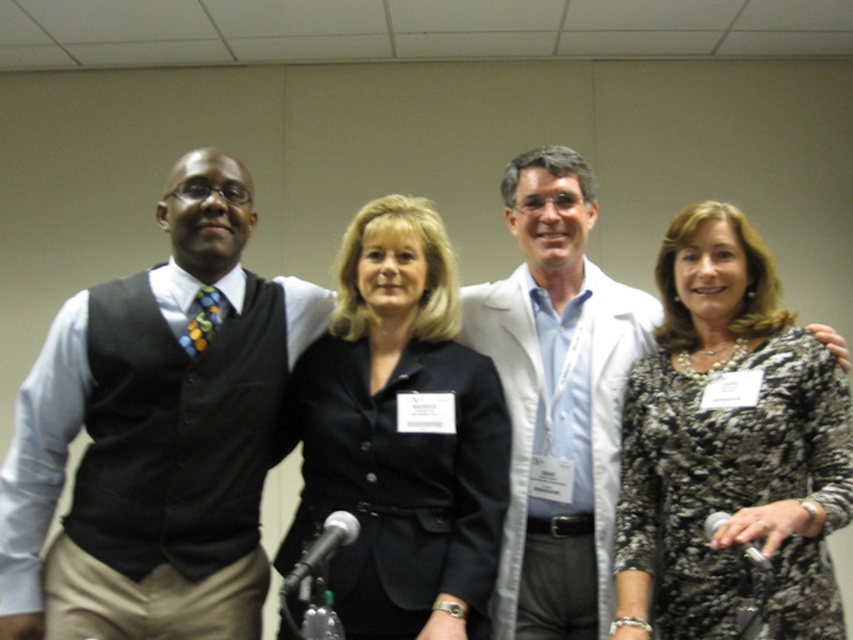
You are standing in the room where the four people are. You want to find the black textured dress at center. Which direction should you look to find it?

The black textured dress at center is located at point 0.700 on the x axis and 0.856 on the y axis. Since the coordinate system is not specified, but assuming standard computer vision coordinates where the origin is at the top left corner, the x increases to the right and y increases downward. Therefore, to find the black textured dress at center, you should look towards the lower right direction from your current position.

From the picture: You are organizing a photo shoot and need to arrange the matte black vest at left and the white lab coat at center so that both are visible in the frame. Given their sizes, which one should you position closer to the camera to ensure both are fully visible?

The matte black vest at left is not as tall as the white lab coat at center, so to ensure both are fully visible in the frame, position the matte black vest at left closer to the camera since it is shorter and requires less space vertically compared to the taller white lab coat at center.

Consider the image. You are a photographer standing in the room. You want to take a photo of the matte black vest at left without any other objects in the frame. Is the distance sufficient to zoom in and capture only the vest?

The distance between the matte black vest at left and the camera is 1.51 meters. This distance may be sufficient to zoom in and capture only the matte black vest at left, depending on the camera lens capabilities.